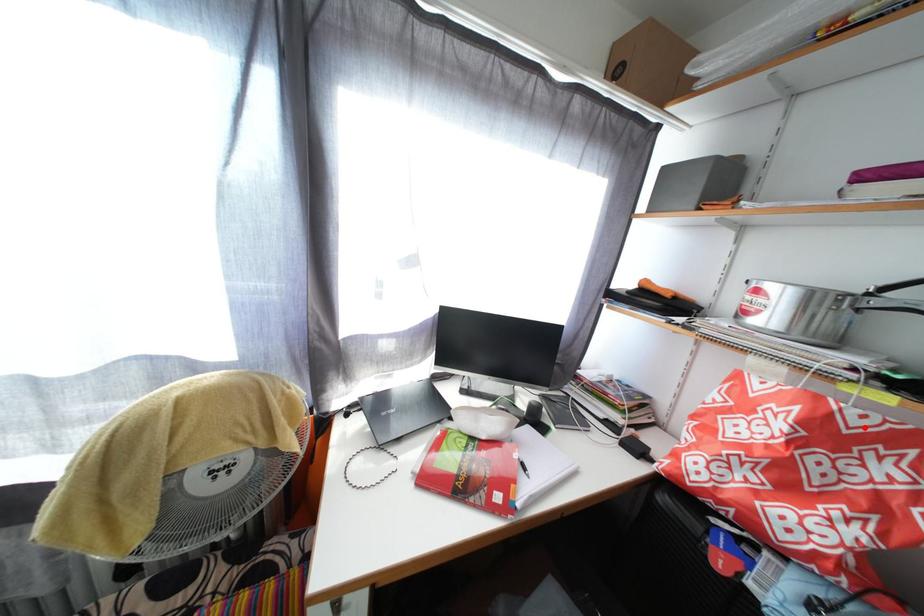
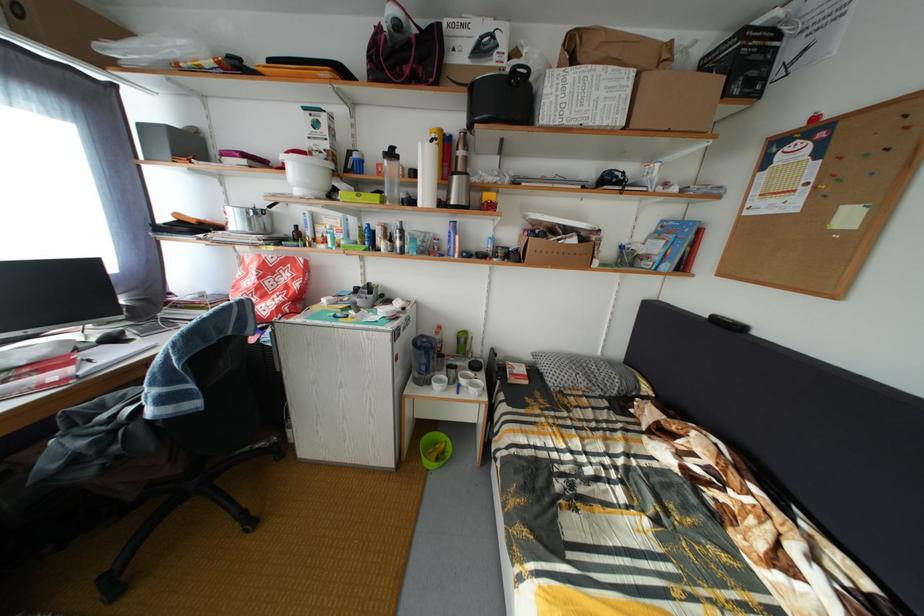
The point at the highlighted location is marked in the first image. Where is the corresponding point in the second image?

(281, 267)